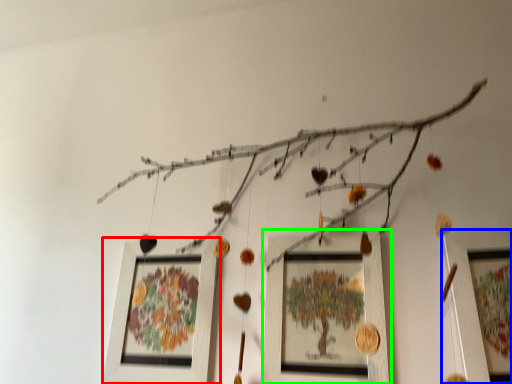
Question: Which is nearer to the picture frame (highlighted by a red box)? picture frame (highlighted by a blue box) or picture frame (highlighted by a green box).

Choices:
 (A) picture frame
 (B) picture frame

Answer: (B)